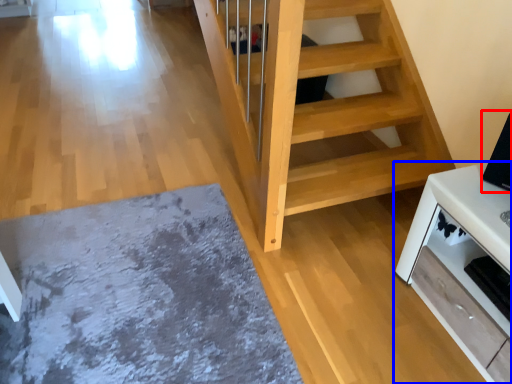
Question: Which object appears farthest to the camera in this image, appliance (highlighted by a red box) or furniture (highlighted by a blue box)?

Choices:
 (A) appliance
 (B) furniture

Answer: (A)